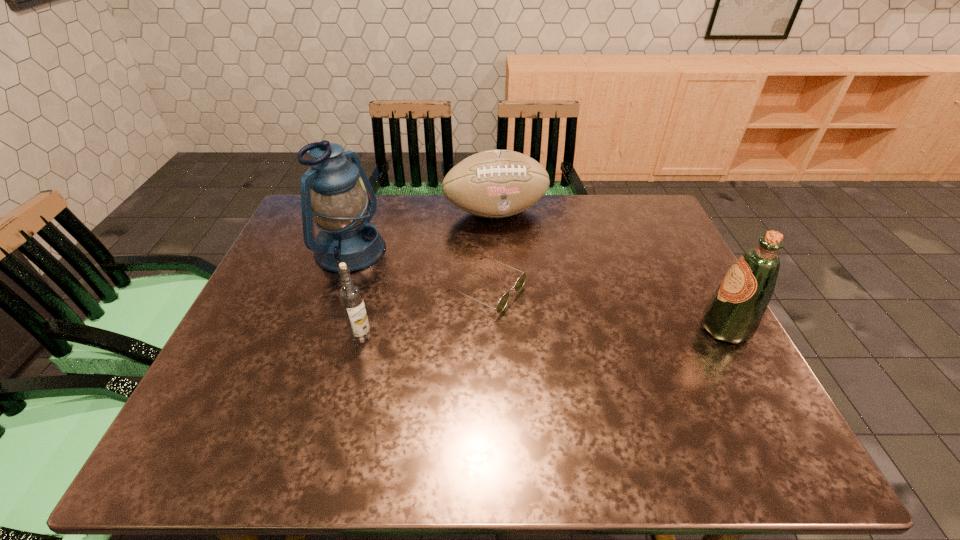
Where is `football (American) at the far edge`? The height and width of the screenshot is (540, 960). football (American) at the far edge is located at coordinates (497, 183).

You are a GUI agent. You are given a task and a screenshot of the screen. Output one action in this format:
    pyautogui.click(x=<x>, y=<y>)
    Task: Click on the object located at the left edge
    This screenshot has height=540, width=960.
    Given the screenshot: What is the action you would take?
    pyautogui.click(x=342, y=209)

At what (x,y) coordinates should I click in order to perform the action: click on object that is at the right edge. Please return your answer as a coordinate pair (x, y). Looking at the image, I should click on (734, 312).

Where is `object present at the far left corner`? object present at the far left corner is located at coordinates (342, 209).

Locate an element on the screen. The width and height of the screenshot is (960, 540). vacant space at the far edge of the desktop is located at coordinates pyautogui.click(x=554, y=197).

In the image, there is a desktop. Where is `vacant space at the near edge`? vacant space at the near edge is located at coordinates (402, 408).

You are a GUI agent. You are given a task and a screenshot of the screen. Output one action in this format:
    pyautogui.click(x=<x>, y=<y>)
    Task: Click on the vacant area at the left edge of the desktop
    Image resolution: width=960 pixels, height=540 pixels.
    Given the screenshot: What is the action you would take?
    pyautogui.click(x=254, y=322)

Where is `free location at the right edge of the desktop`? This screenshot has height=540, width=960. free location at the right edge of the desktop is located at coordinates (733, 357).

Where is `free point at the far right corner`? This screenshot has height=540, width=960. free point at the far right corner is located at coordinates (635, 210).

You are a GUI agent. You are given a task and a screenshot of the screen. Output one action in this format:
    pyautogui.click(x=<x>, y=<y>)
    Task: Click on the vacant area that lies between the olive oil and the football (American)
    This screenshot has width=960, height=540.
    Given the screenshot: What is the action you would take?
    pyautogui.click(x=611, y=271)